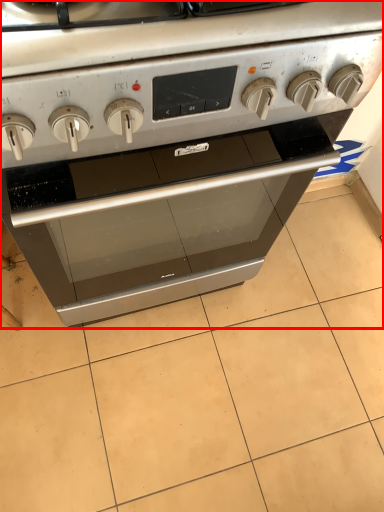
Question: From the image's perspective, where is oven (annotated by the red box) located relative to tile?

Choices:
 (A) below
 (B) above

Answer: (B)